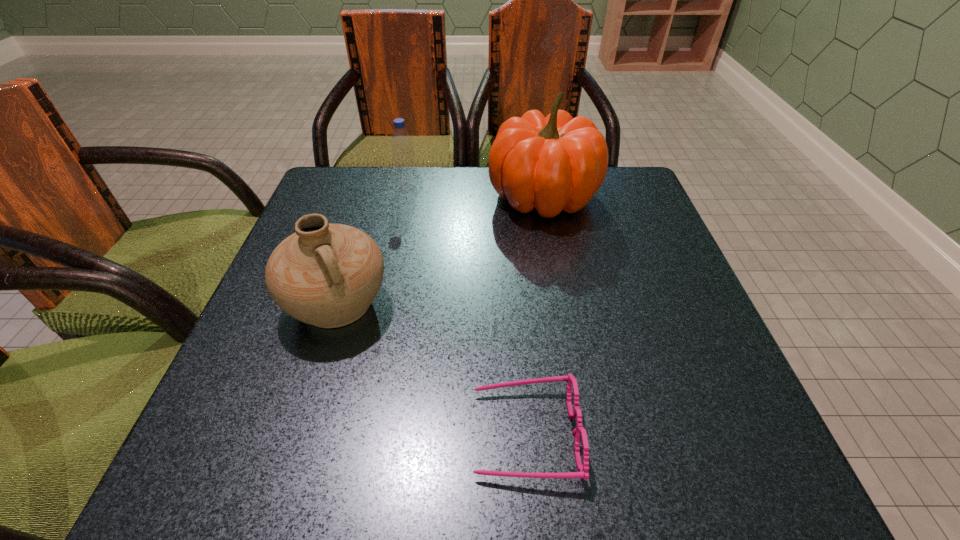
The height and width of the screenshot is (540, 960). In order to click on vacant space at the near left corner in this screenshot , I will do `click(224, 458)`.

In the image, there is a desktop. Where is `free region at the far right corner`? This screenshot has width=960, height=540. free region at the far right corner is located at coordinates (645, 212).

Identify the location of vacant space that's between the bottle and the tallest object. (475, 192).

You are a GUI agent. You are given a task and a screenshot of the screen. Output one action in this format:
    pyautogui.click(x=<x>, y=<y>)
    Task: Click on the empty space between the tallest object and the third farthest object
    This screenshot has height=540, width=960.
    Given the screenshot: What is the action you would take?
    pyautogui.click(x=441, y=251)

Identify the location of vacant area that lies between the nearest object and the pottery. (431, 369).

I want to click on free space between the spectacles and the pottery, so click(431, 369).

Locate an element on the screen. free space that is in between the third farthest object and the shortest object is located at coordinates (431, 369).

This screenshot has height=540, width=960. In order to click on vacant area that lies between the nearest object and the bottle in this screenshot , I will do `click(466, 310)`.

This screenshot has width=960, height=540. Find the location of `vacant region between the pottery and the pumpkin`. vacant region between the pottery and the pumpkin is located at coordinates (441, 251).

Select which object is the third closest to the shortest object. Please provide its 2D coordinates. Your answer should be formatted as a tuple, i.e. [(x, y)], where the tuple contains the x and y coordinates of a point satisfying the conditions above.

[(405, 172)]